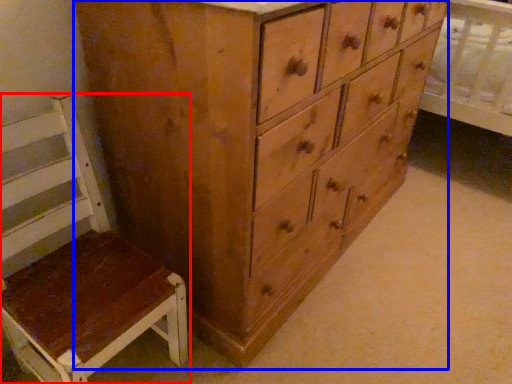
Question: Which object appears farthest to the camera in this image, furniture (highlighted by a red box) or chest of drawers (highlighted by a blue box)?

Choices:
 (A) furniture
 (B) chest of drawers

Answer: (B)